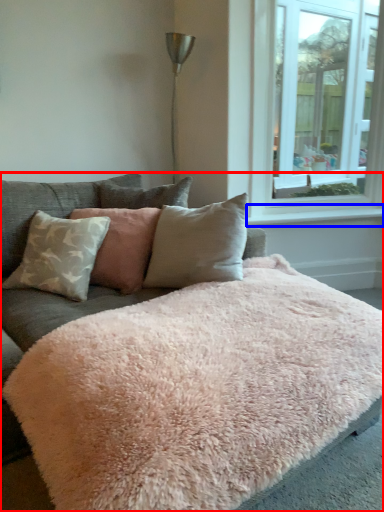
Question: Which point is closer to the camera, studio couch (highlighted by a red box) or window sill (highlighted by a blue box)?

Choices:
 (A) studio couch
 (B) window sill

Answer: (A)